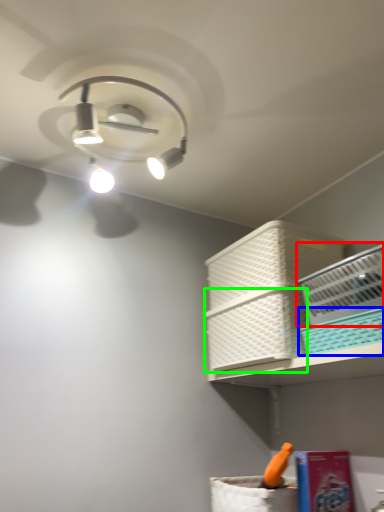
Question: Considering the real-world distances, which object is farthest from basket (highlighted by a red box)? basket (highlighted by a blue box) or basket (highlighted by a green box)?

Choices:
 (A) basket
 (B) basket

Answer: (B)